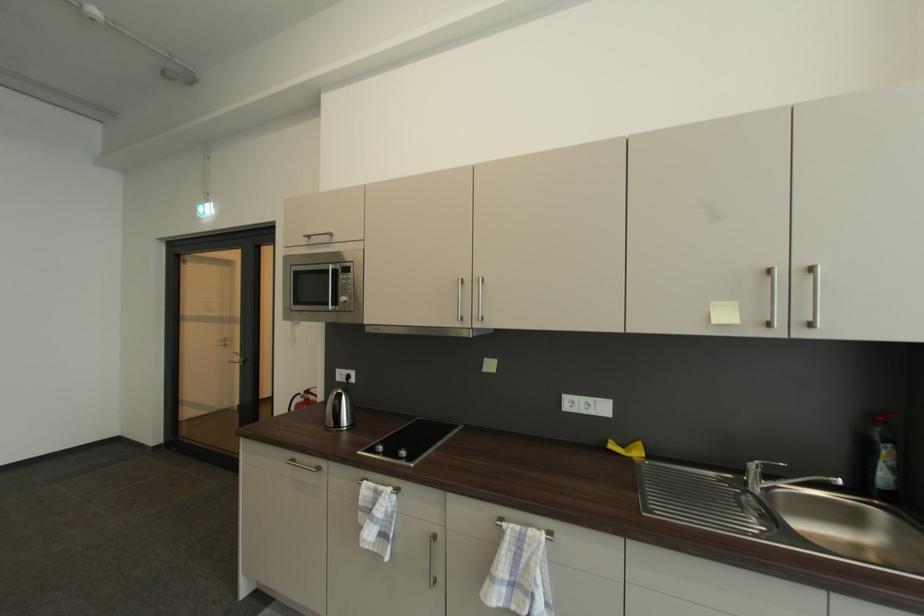
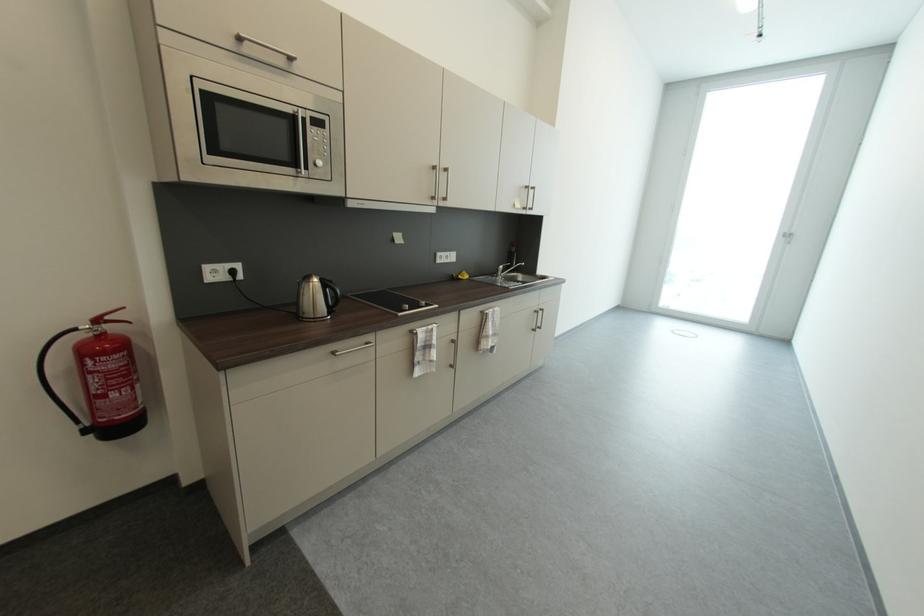
The point at [319,392] is marked in the first image. Where is the corresponding point in the second image?

(116, 318)